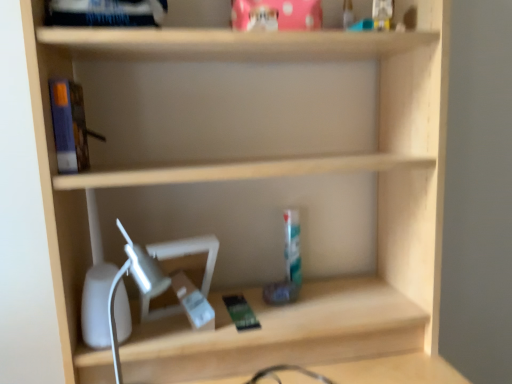
Question: From a real-world perspective, is white plastic table lamp at lower left over blue matte book at left?

Choices:
 (A) yes
 (B) no

Answer: (B)

Question: Is white plastic table lamp at lower left thinner than blue matte book at left?

Choices:
 (A) yes
 (B) no

Answer: (B)

Question: Is white plastic table lamp at lower left at the right side of blue matte book at left?

Choices:
 (A) yes
 (B) no

Answer: (A)

Question: From the image's perspective, is white plastic table lamp at lower left beneath blue matte book at left?

Choices:
 (A) no
 (B) yes

Answer: (B)

Question: Is white plastic table lamp at lower left positioned with its back to blue matte book at left?

Choices:
 (A) no
 (B) yes

Answer: (A)

Question: Are white plastic table lamp at lower left and blue matte book at left making contact?

Choices:
 (A) yes
 (B) no

Answer: (B)

Question: Is blue matte book at left at the left side of white plastic table lamp at lower left?

Choices:
 (A) no
 (B) yes

Answer: (B)

Question: From a real-world perspective, is blue matte book at left physically below white plastic table lamp at lower left?

Choices:
 (A) no
 (B) yes

Answer: (A)

Question: From a real-world perspective, is blue matte book at left over white plastic table lamp at lower left?

Choices:
 (A) no
 (B) yes

Answer: (B)

Question: Can you confirm if blue matte book at left is smaller than white plastic table lamp at lower left?

Choices:
 (A) yes
 (B) no

Answer: (A)

Question: Is there a large distance between blue matte book at left and white plastic table lamp at lower left?

Choices:
 (A) yes
 (B) no

Answer: (B)

Question: Does blue matte book at left turn towards white plastic table lamp at lower left?

Choices:
 (A) yes
 (B) no

Answer: (B)

Question: From the image's perspective, is blue matte book at left located above or below white plastic table lamp at lower left?

Choices:
 (A) below
 (B) above

Answer: (B)